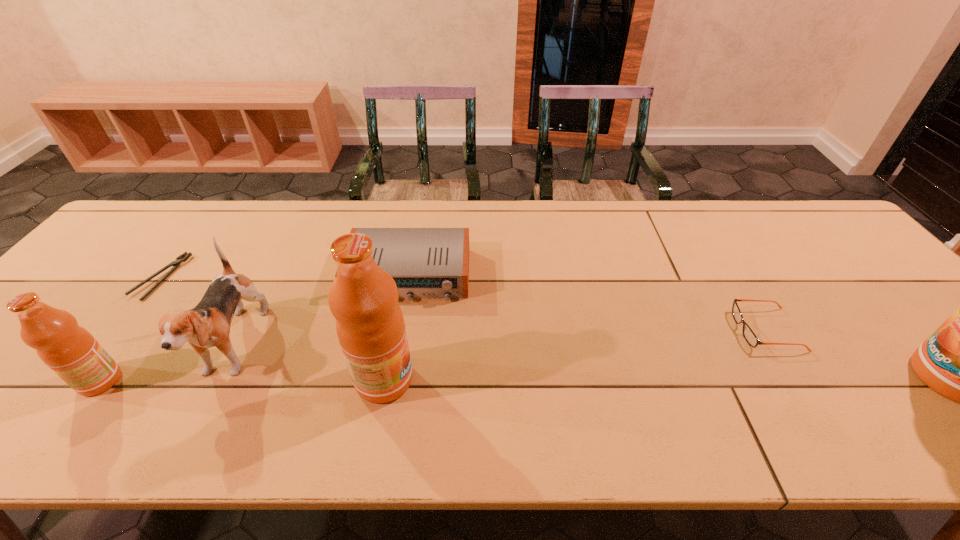
If we want them evenly spaced by inserting an extra fruit_juice among them, please locate a free spot for this new fruit_juice. Please provide its 2D coordinates. Your answer should be formatted as a tuple, i.e. [(x, y)], where the tuple contains the x and y coordinates of a point satisfying the conditions above.

[(667, 379)]